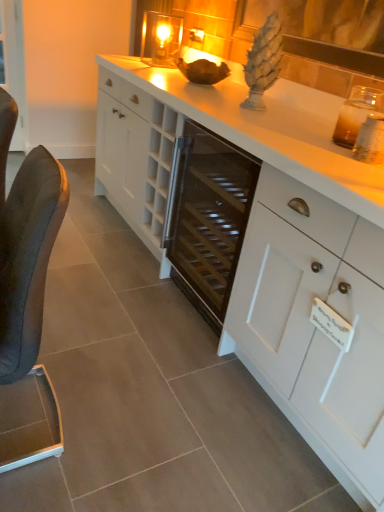
Describe the element at coordinates (14, 66) in the screenshot. I see `transparent glass door at left` at that location.

The height and width of the screenshot is (512, 384). Describe the element at coordinates (270, 129) in the screenshot. I see `white glossy countertop at center` at that location.

What is the approximate height of white glossy countertop at center?

37.90 inches.

Describe the element at coordinates (161, 39) in the screenshot. This screenshot has height=512, width=384. I see `clear glass candle at upper center` at that location.

Measure the distance between black leather chair at left and camera.

black leather chair at left is 36.85 inches away from camera.

Describe the element at coordinates (28, 310) in the screenshot. I see `black leather chair at left` at that location.

Locate an element on the screen. Image resolution: width=384 pixels, height=512 pixels. white matte cabinet at center is located at coordinates (315, 326).

Consider the image. Who is taller, transparent glass door at left or black leather chair at left?

Standing taller between the two is transparent glass door at left.

Considering the sizes of transparent glass door at left and black leather chair at left in the image, is transparent glass door at left bigger or smaller than black leather chair at left?

Clearly, transparent glass door at left is smaller in size than black leather chair at left.

Is transparent glass door at left aimed at black leather chair at left?

No, transparent glass door at left is not oriented towards black leather chair at left.

Is black leather chair at left placed right next to transparent glass door at left?

black leather chair at left is not next to transparent glass door at left, and they're not touching.

Is transparent glass door at left at the back of black leather chair at left?

No, black leather chair at left is not facing the opposite direction of transparent glass door at left.

From a real-world perspective, is black leather chair at left positioned above or below transparent glass door at left?

Clearly, from a real-world perspective, black leather chair at left is below transparent glass door at left.

Is black leather chair at left not within transparent glass door at left?

Yes, black leather chair at left is located beyond the bounds of transparent glass door at left.

Is clear glass candle at upper center positioned behind transparent glass door at left?

No, clear glass candle at upper center is closer to the camera.

You are a GUI agent. You are given a task and a screenshot of the screen. Output one action in this format:
    pyautogui.click(x=<x>, y=<y>)
    Task: Click on the glass door that is on the left side of clear glass candle at upper center
    Image resolution: width=384 pixels, height=512 pixels.
    Given the screenshot: What is the action you would take?
    pyautogui.click(x=14, y=66)

Is clear glass candle at upper center looking in the opposite direction of transparent glass door at left?

clear glass candle at upper center is not turned away from transparent glass door at left.

Considering the relative positions of clear glass candle at upper center and transparent glass door at left in the image provided, is clear glass candle at upper center to the left of transparent glass door at left from the viewer's perspective?

Incorrect, clear glass candle at upper center is not on the left side of transparent glass door at left.

From the image's perspective, is transparent glass door at left positioned above or below white matte cabinet at center?

From the image's perspective, transparent glass door at left appears above white matte cabinet at center.

Based on the photo, is transparent glass door at left behind white matte cabinet at center?

Yes, transparent glass door at left is further from the camera.

Is transparent glass door at left positioned far away from white matte cabinet at center?

That's right, there is a large distance between transparent glass door at left and white matte cabinet at center.

Is white matte cabinet at center surrounded by transparent glass door at left?

No, white matte cabinet at center is not a part of transparent glass door at left.

Which object is thinner, white glossy countertop at center or black leather chair at left?

With smaller width is black leather chair at left.

Which object is further away from the camera, white glossy countertop at center or black leather chair at left?

Positioned behind is white glossy countertop at center.

Is white glossy countertop at center facing towards black leather chair at left?

No, white glossy countertop at center is not turned towards black leather chair at left.

Is white glossy countertop at center beside black leather chair at left?

No, white glossy countertop at center is not in contact with black leather chair at left.

Based on the photo, from the image's perspective, who appears lower, white matte cabinet at center or white glossy countertop at center?

white matte cabinet at center is shown below in the image.

Between point (367, 418) and point (233, 90), which one is positioned behind?

The point (233, 90) is behind.

In terms of height, does white matte cabinet at center look taller or shorter compared to white glossy countertop at center?

In the image, white matte cabinet at center appears to be shorter than white glossy countertop at center.

Does white glossy countertop at center have a lesser width compared to transparent glass door at left?

No.

Looking at this image, is white glossy countertop at center taller or shorter than transparent glass door at left?

Clearly, white glossy countertop at center is shorter compared to transparent glass door at left.

Would you say white glossy countertop at center is inside or outside transparent glass door at left?

white glossy countertop at center is located beyond the bounds of transparent glass door at left.

Locate an element on the screen. The image size is (384, 512). furniture that appears in front of the transparent glass door at left is located at coordinates (28, 310).

Locate an element on the screen. This screenshot has width=384, height=512. glass door above the black leather chair at left (from the image's perspective) is located at coordinates (14, 66).

Considering their positions, is white glossy countertop at center positioned closer to black leather chair at left than clear glass candle at upper center?

white glossy countertop at center lies closer to black leather chair at left than the other object.

Which object lies nearer to the anchor point white glossy countertop at center, transparent glass door at left or white matte cabinet at center?

The object closer to white glossy countertop at center is white matte cabinet at center.

When comparing their distances from white glossy countertop at center, does black leather chair at left or transparent glass door at left seem closer?

black leather chair at left lies closer to white glossy countertop at center than the other object.

Considering their positions, is black leather chair at left positioned closer to clear glass candle at upper center than transparent glass door at left?

transparent glass door at left lies closer to clear glass candle at upper center than the other object.

Based on the photo, from the image, which object appears to be nearer to black leather chair at left, white matte cabinet at center or transparent glass door at left?

white matte cabinet at center is positioned closer to the anchor black leather chair at left.

In the scene shown: Estimate the real-world distances between objects in this image. Which object is closer to white glossy countertop at center, transparent glass door at left or black leather chair at left?

black leather chair at left lies closer to white glossy countertop at center than the other object.

Estimate the real-world distances between objects in this image. Which object is further from white matte cabinet at center, transparent glass door at left or clear glass candle at upper center?

The object further to white matte cabinet at center is transparent glass door at left.

Considering their positions, is white glossy countertop at center positioned further to clear glass candle at upper center than black leather chair at left?

Among the two, black leather chair at left is located further to clear glass candle at upper center.

The height and width of the screenshot is (512, 384). I want to click on furniture between white matte cabinet at center and transparent glass door at left from front to back, so click(x=28, y=310).

Identify the location of countertop located between white matte cabinet at center and clear glass candle at upper center in the depth direction. (270, 129).

Where is `furniture located between white matte cabinet at center and white glossy countertop at center in the depth direction`? The height and width of the screenshot is (512, 384). furniture located between white matte cabinet at center and white glossy countertop at center in the depth direction is located at coordinates (28, 310).

Locate an element on the screen. The height and width of the screenshot is (512, 384). candle holder positioned between white matte cabinet at center and transparent glass door at left from near to far is located at coordinates (161, 39).